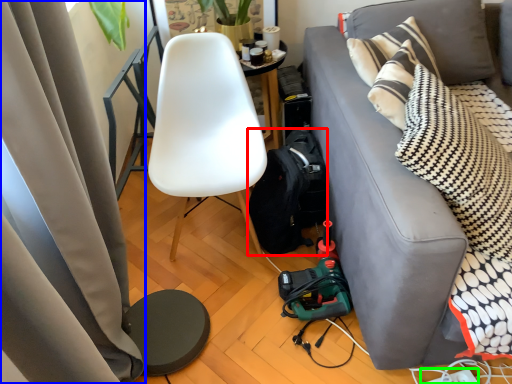
Question: Which is farther away from backpack (highlighted by a red box)? curtain (highlighted by a blue box) or power outlet (highlighted by a green box)?

Choices:
 (A) curtain
 (B) power outlet

Answer: (B)